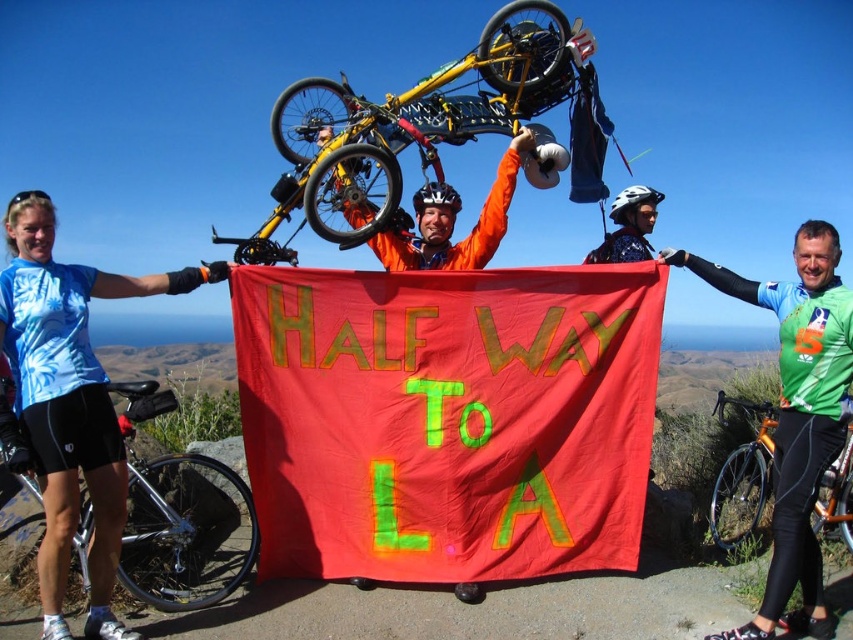
Question: Estimate the real-world distances between objects in this image. Which object is farther from the smooth skin head at upper right?

Choices:
 (A) yellow matte mountain bike at upper center
 (B) matte orange helmet at center
 (C) orange metallic bicycle at center
 (D) green jersey at center

Answer: (A)

Question: Does orange metallic bicycle at center have a lesser width compared to blue fabric head at upper left?

Choices:
 (A) yes
 (B) no

Answer: (B)

Question: Which point is closer to the camera?

Choices:
 (A) smooth skin head at upper right
 (B) matte black helmet at center
 (C) matte orange helmet at center

Answer: (A)

Question: Is green jersey at center further to the viewer compared to matte black helmet at center?

Choices:
 (A) yes
 (B) no

Answer: (B)

Question: Which is nearer to the orange metallic bicycle at center?

Choices:
 (A) matte orange helmet at center
 (B) orange matte bicycle at center
 (C) matte black helmet at center

Answer: (C)

Question: Does orange matte bicycle at center appear over orange metallic bicycle at center?

Choices:
 (A) no
 (B) yes

Answer: (B)